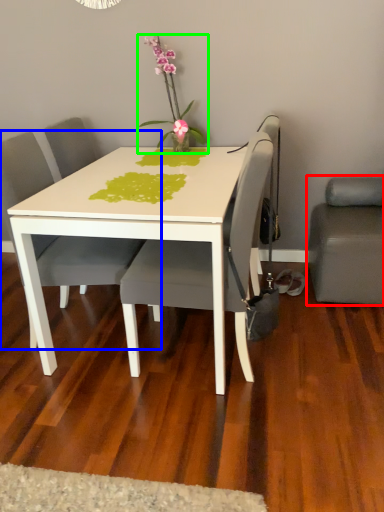
Question: Estimate the real-world distances between objects in this image. Which object is closer to studio couch (highlighted by a red box), chair (highlighted by a blue box) or houseplant (highlighted by a green box)?

Choices:
 (A) chair
 (B) houseplant

Answer: (B)